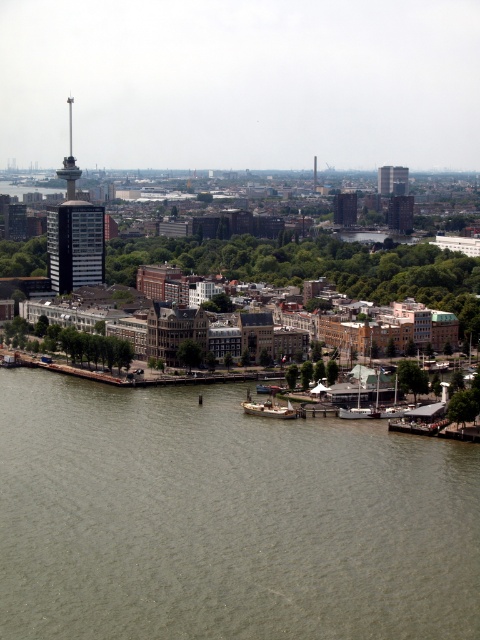
Who is taller, wooden ship at lower center or wooden boat at lower right?

Standing taller between the two is wooden boat at lower right.

What do you see at coordinates (267, 408) in the screenshot? I see `wooden ship at lower center` at bounding box center [267, 408].

Locate an element on the screen. wooden ship at lower center is located at coordinates [x=267, y=408].

Does greenish-gray water at lower center have a greater width compared to wooden boat at lower right?

Indeed, greenish-gray water at lower center has a greater width compared to wooden boat at lower right.

Who is more forward, (36, 380) or (384, 410)?

Point (384, 410) is more forward.

Is point (217, 468) behind point (388, 416)?

That is False.

Where is `greenish-gray water at lower center`? greenish-gray water at lower center is located at coordinates (226, 518).

Between greenish-gray water at lower center and wooden ship at lower center, which one has more height?

greenish-gray water at lower center

Is greenish-gray water at lower center in front of wooden ship at lower center?

Yes, it is in front of wooden ship at lower center.

Is point (257, 596) positioned before point (282, 416)?

Yes.

The width and height of the screenshot is (480, 640). I want to click on greenish-gray water at lower center, so click(226, 518).